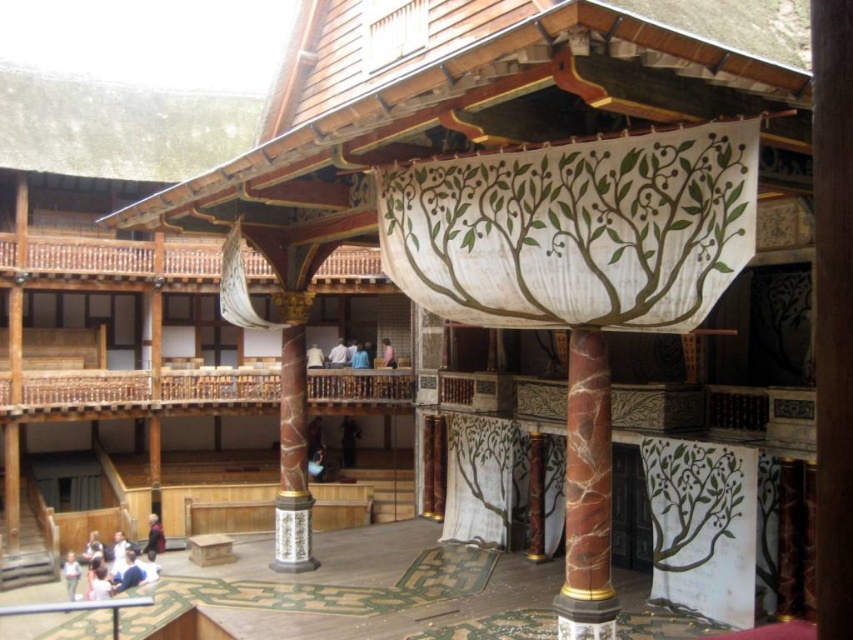
You are an architect examining the theater interior. You notice the marble column at center and the light blue fabric at upper center. From your vantage point, which object is positioned to the left?

The light blue fabric at upper center is positioned to the left of the marble column at center.

You are an architect designing a stage backdrop for a play set in this theater. You need to place a tall prop that must be visible above the marble column at center and the light blue fabric at upper center. Which object will the prop need to be taller than?

The prop must be taller than the marble column at center because it is taller than the light blue fabric at upper center.

You are an actor preparing to enter the stage of this historical theater. You notice a light blue shirt at lower left and a light blue fabric at upper center. Which one is nearer to you as you stand on the stage?

The light blue shirt at lower left is closer to the viewer than the light blue fabric at upper center, so the light blue shirt at lower left is nearer to you as you stand on the stage.